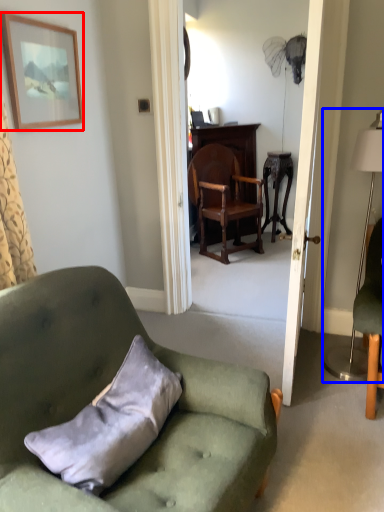
Question: Which object is closer to the camera taking this photo, picture frame (highlighted by a red box) or lamp (highlighted by a blue box)?

Choices:
 (A) picture frame
 (B) lamp

Answer: (B)